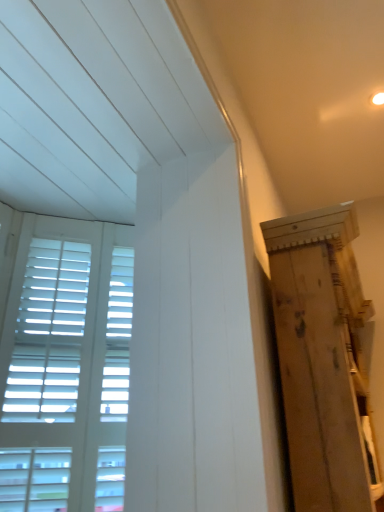
Question: Is natural wood plywood at right taller than white wooden shutters at left?

Choices:
 (A) yes
 (B) no

Answer: (B)

Question: Considering the relative positions of natural wood plywood at right and white wooden shutters at left in the image provided, is natural wood plywood at right to the right of white wooden shutters at left from the viewer's perspective?

Choices:
 (A) no
 (B) yes

Answer: (B)

Question: Does natural wood plywood at right have a lesser width compared to white wooden shutters at left?

Choices:
 (A) no
 (B) yes

Answer: (A)

Question: Is natural wood plywood at right placed right next to white wooden shutters at left?

Choices:
 (A) no
 (B) yes

Answer: (A)

Question: Is natural wood plywood at right outside of white wooden shutters at left?

Choices:
 (A) no
 (B) yes

Answer: (B)

Question: Is natural wood plywood at right far from white wooden shutters at left?

Choices:
 (A) no
 (B) yes

Answer: (A)

Question: Is white wooden shutters at left closer to the viewer compared to natural wood plywood at right?

Choices:
 (A) no
 (B) yes

Answer: (A)

Question: Does white wooden shutters at left touch natural wood plywood at right?

Choices:
 (A) no
 (B) yes

Answer: (A)

Question: Does white wooden shutters at left appear on the left side of natural wood plywood at right?

Choices:
 (A) no
 (B) yes

Answer: (B)

Question: Is white wooden shutters at left not within natural wood plywood at right?

Choices:
 (A) no
 (B) yes

Answer: (B)

Question: Can you confirm if white wooden shutters at left is thinner than natural wood plywood at right?

Choices:
 (A) yes
 (B) no

Answer: (A)

Question: Considering the relative sizes of white wooden shutters at left and natural wood plywood at right in the image provided, is white wooden shutters at left wider than natural wood plywood at right?

Choices:
 (A) no
 (B) yes

Answer: (A)

Question: Is white wooden shutters at left taller or shorter than natural wood plywood at right?

Choices:
 (A) tall
 (B) short

Answer: (A)